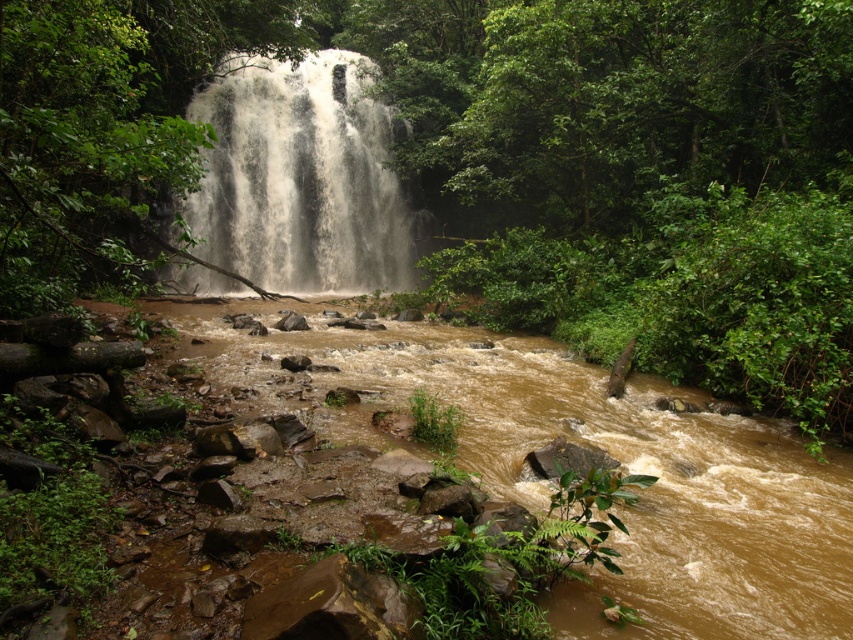
Is brown muddy stream at center behind white frothy water at center?

No.

Consider the image. Does brown muddy stream at center come in front of white frothy water at center?

Yes, it is in front of white frothy water at center.

From the picture: Who is more distant from viewer, (817, 504) or (325, 64)?

Positioned behind is point (325, 64).

Image resolution: width=853 pixels, height=640 pixels. Find the location of `brown muddy stream at center`. brown muddy stream at center is located at coordinates (601, 449).